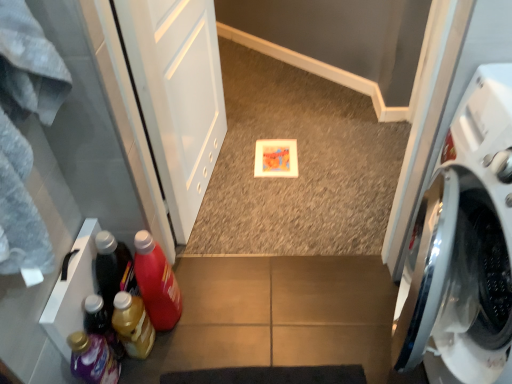
Question: From their relative heights in the image, would you say matte plastic bottle at lower left, positioned as the fourth bottle in left-to-right order, is taller or shorter than white glossy washing machine at right?

Choices:
 (A) tall
 (B) short

Answer: (B)

Question: Is matte plastic bottle at lower left, which is counted as the 1th bottle, starting from the right, in front of or behind white glossy washing machine at right in the image?

Choices:
 (A) front
 (B) behind

Answer: (B)

Question: Which is farther from the translucent plastic detergent at lower left, which ranks as the 4th bottle in right-to-left order?

Choices:
 (A) matte plastic bottle at lower left, which is counted as the 1th bottle, starting from the right
 (B) translucent yellow bottle at lower left, which is the 2th bottle from right to left
 (C) translucent plastic bottle at lower left, the 3th bottle from the right
 (D) white glossy washing machine at right
 (E) white glossy screen door at upper left

Answer: (D)

Question: Considering the real-world distances, which object is closest to the matte plastic bottle at lower left, which is counted as the 1th bottle, starting from the right?

Choices:
 (A) translucent plastic detergent at lower left, which ranks as the 4th bottle in right-to-left order
 (B) white glossy screen door at upper left
 (C) translucent yellow bottle at lower left, the 3th bottle when ordered from left to right
 (D) translucent plastic bottle at lower left, the 3th bottle from the right
 (E) white glossy washing machine at right

Answer: (C)